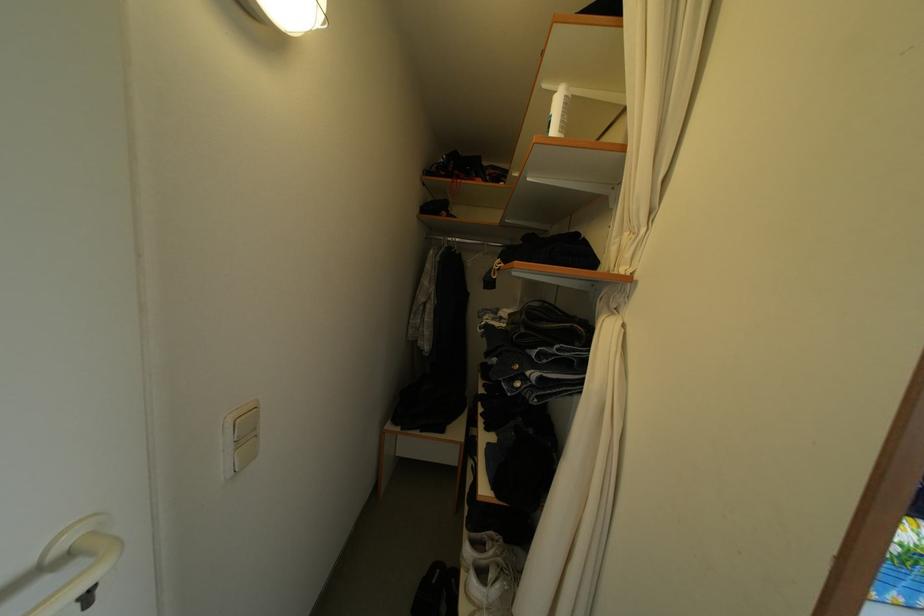
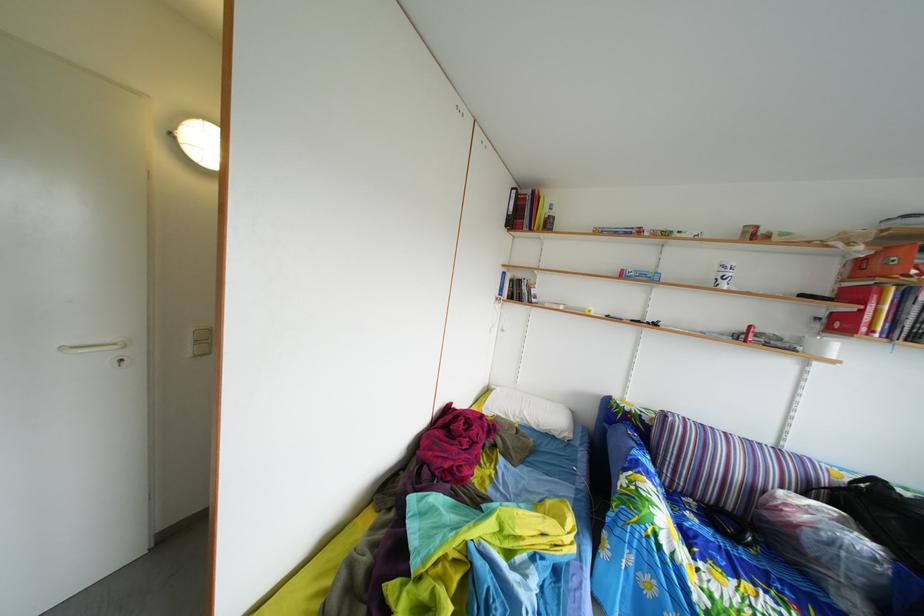
Question: The images are taken continuously from a first-person perspective. In which direction are you moving?

Choices:
 (A) Left
 (B) Right
 (C) Forward
 (D) Backward

Answer: (B)